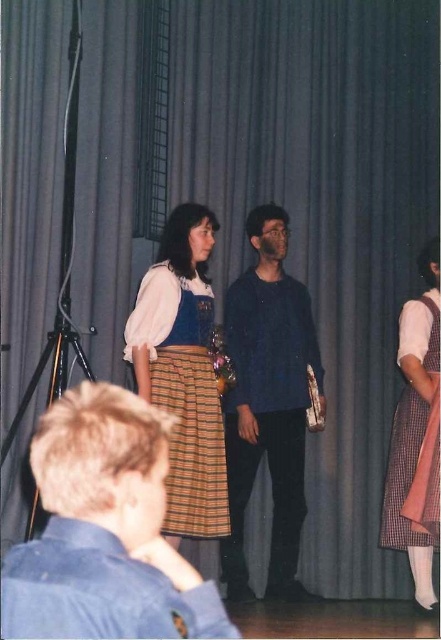
Question: Which of the following is the closest to the observer?

Choices:
 (A) matte white blouse at center
 (B) blue cotton shirt at center

Answer: (B)

Question: Is matte white blouse at center smaller than checkered fabric dress at right?

Choices:
 (A) yes
 (B) no

Answer: (B)

Question: Which is nearer to the dark blue sweater at center?

Choices:
 (A) checkered fabric dress at right
 (B) matte white blouse at center
 (C) blue cotton shirt at center

Answer: (B)

Question: Which point appears farthest from the camera in this image?

Choices:
 (A) (217, 528)
 (B) (183, 586)
 (C) (414, 451)
 (D) (272, 305)

Answer: (D)

Question: Is dark blue sweater at center smaller than checkered fabric dress at right?

Choices:
 (A) yes
 (B) no

Answer: (B)

Question: Does blue cotton shirt at center appear on the left side of matte white blouse at center?

Choices:
 (A) yes
 (B) no

Answer: (B)